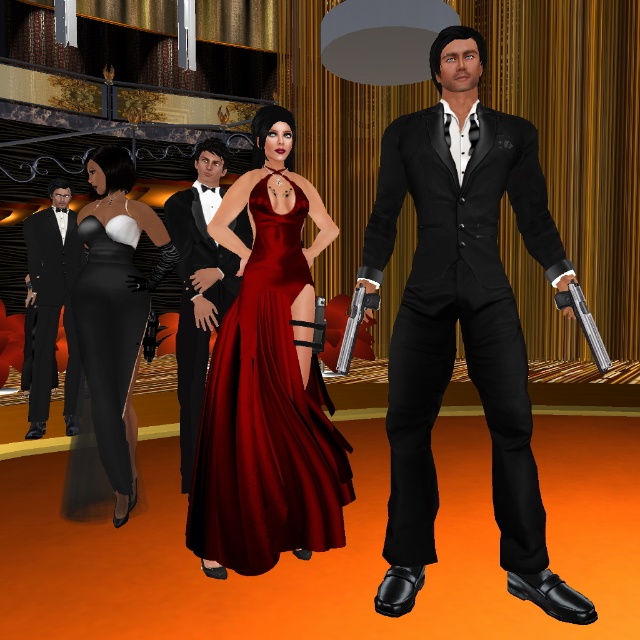
Question: Considering the relative positions of satin dress at center and shiny black suit at left in the image provided, where is satin dress at center located with respect to shiny black suit at left?

Choices:
 (A) right
 (B) left

Answer: (A)

Question: Considering the relative positions of shiny satin gown at center and matte black dress at left in the image provided, where is shiny satin gown at center located with respect to matte black dress at left?

Choices:
 (A) above
 (B) below

Answer: (A)

Question: Which object appears closest to the camera in this image?

Choices:
 (A) matte black dress at left
 (B) matte black suit at center
 (C) shiny black tuxedo at center

Answer: (B)

Question: Which point is farther to the camera?

Choices:
 (A) (54, 202)
 (B) (337, 492)

Answer: (A)

Question: Which of the following is the closest to the observer?

Choices:
 (A) (49, 188)
 (B) (492, 470)
 (C) (278, 316)
 (D) (310, 282)

Answer: (B)

Question: Is shiny satin gown at center wider than matte black dress at left?

Choices:
 (A) yes
 (B) no

Answer: (A)